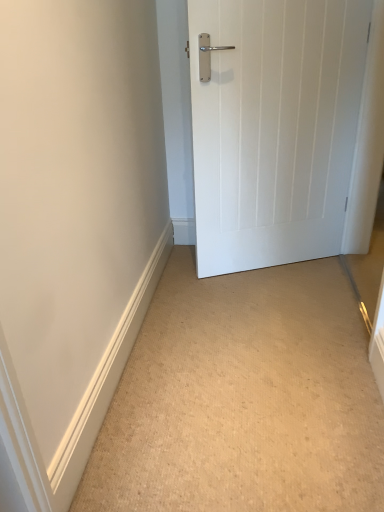
You are a GUI agent. You are given a task and a screenshot of the screen. Output one action in this format:
    pyautogui.click(x=<x>, y=<y>)
    Task: Click on the empty space that is ontop of beige carpet at lower center (from a real-world perspective)
    The height and width of the screenshot is (512, 384).
    Given the screenshot: What is the action you would take?
    pyautogui.click(x=248, y=375)